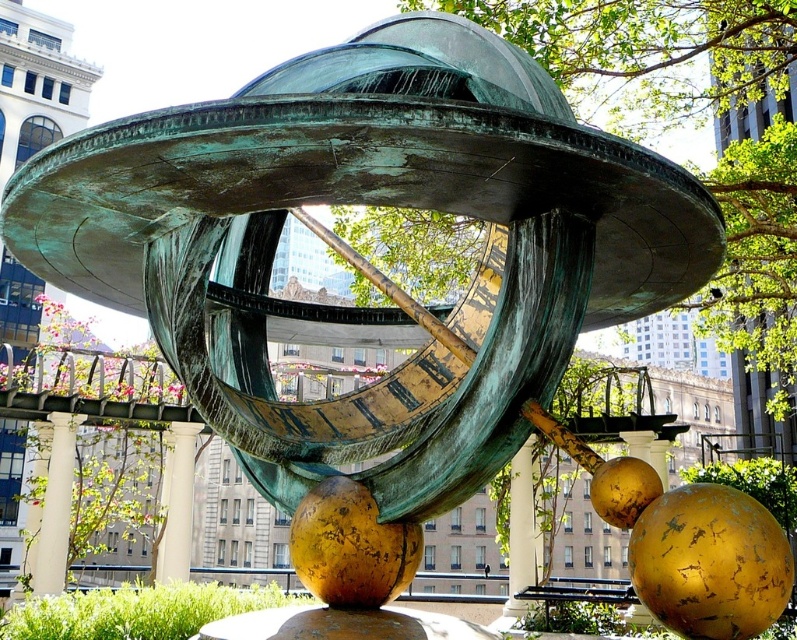
Between white marble pillar at lower left and green patina pillar at center, which one appears on the right side from the viewer's perspective?

green patina pillar at center is more to the right.

Which is behind, point (46, 593) or point (512, 580)?

Positioned behind is point (512, 580).

Between point (53, 589) and point (525, 474), which one is positioned in front?

Point (53, 589)

I want to click on white marble pillar at lower left, so click(x=57, y=506).

Does white marble pillar at center appear under green patina pillar at center?

No.

Is white marble pillar at center closer to camera compared to green patina pillar at center?

That is True.

Is point (163, 580) farther from viewer compared to point (525, 561)?

That is False.

You are a GUI agent. You are given a task and a screenshot of the screen. Output one action in this format:
    pyautogui.click(x=<x>, y=<y>)
    Task: Click on the white marble pillar at center
    
    Given the screenshot: What is the action you would take?
    pyautogui.click(x=177, y=502)

Which of these two, white marble pillar at lower left or white marble pillar at center, stands shorter?

white marble pillar at lower left is shorter.

Who is more forward, (65, 548) or (175, 432)?

Point (65, 548) is more forward.

Who is more distant from viewer, (53, 435) or (197, 432)?

The point (197, 432) is more distant.

I want to click on white marble pillar at lower left, so click(57, 506).